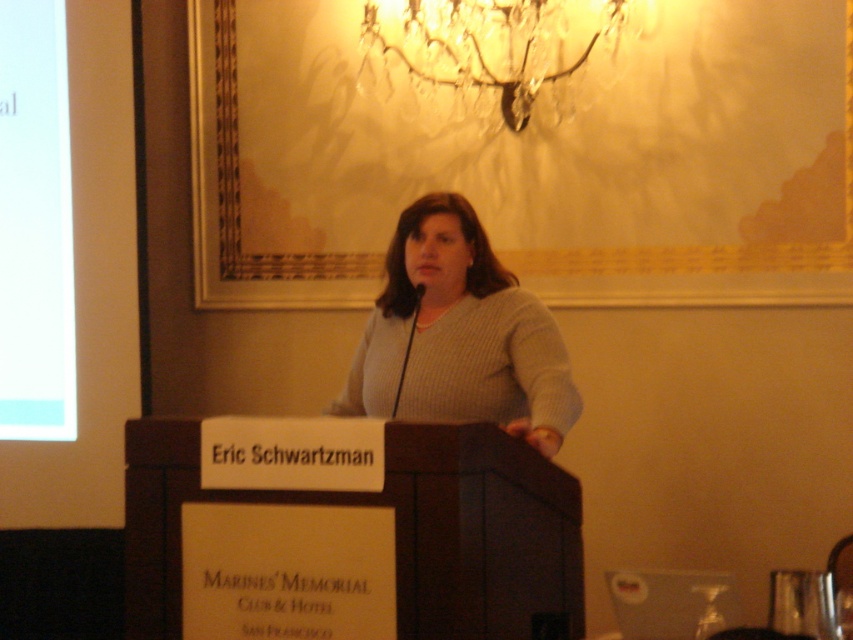
Question: Which object is closer to the camera taking this photo?

Choices:
 (A) gray knitted sweater at center
 (B) crystal glass chandelier at upper center

Answer: (A)

Question: Can you confirm if gray knitted sweater at center is bigger than crystal glass chandelier at upper center?

Choices:
 (A) no
 (B) yes

Answer: (B)

Question: Does gray knitted sweater at center have a lesser width compared to crystal glass chandelier at upper center?

Choices:
 (A) no
 (B) yes

Answer: (B)

Question: Which point appears closest to the camera in this image?

Choices:
 (A) (433, 346)
 (B) (578, 67)

Answer: (A)

Question: Which object appears closest to the camera in this image?

Choices:
 (A) gray knitted sweater at center
 (B) crystal glass chandelier at upper center

Answer: (A)

Question: From the image, what is the correct spatial relationship of gray knitted sweater at center in relation to crystal glass chandelier at upper center?

Choices:
 (A) below
 (B) above

Answer: (A)